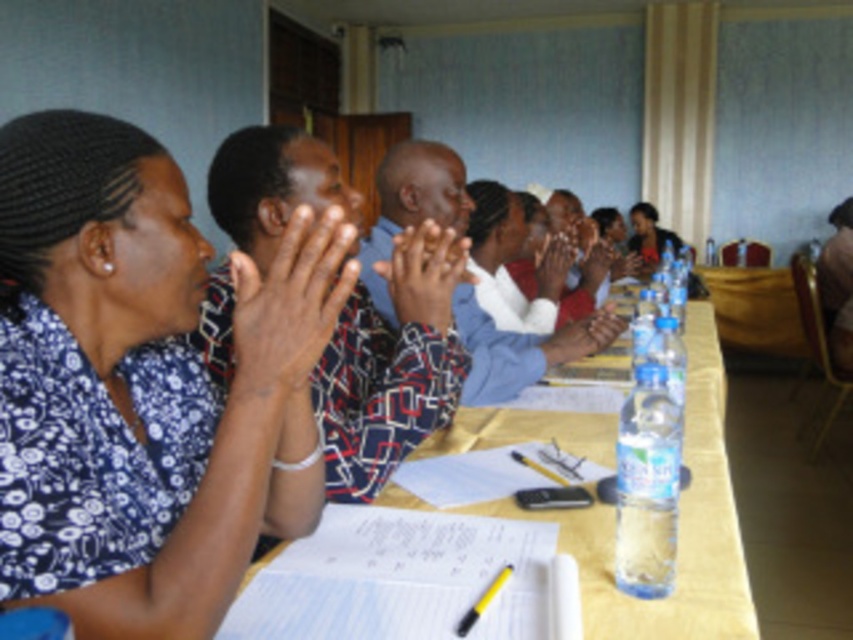
Question: Does yellow matte table at center have a smaller size compared to matte black hands at center?

Choices:
 (A) yes
 (B) no

Answer: (B)

Question: Among these objects, which one is nearest to the camera?

Choices:
 (A) matte plastic hands at center
 (B) blue floral shirt at center
 (C) blue printed shirt at center
 (D) yellow matte table at center

Answer: (B)

Question: Which of the following is the closest to the observer?

Choices:
 (A) matte skin hand at center
 (B) matte plastic hands at center

Answer: (B)

Question: Is blue floral shirt at center below blue printed shirt at center?

Choices:
 (A) yes
 (B) no

Answer: (A)

Question: Which object is positioned closest to the blue floral shirt at center?

Choices:
 (A) matte skin hand at center
 (B) matte plastic hands at center
 (C) yellow matte table at center

Answer: (B)

Question: Considering the relative positions of blue printed shirt at center and dark brown skin at center in the image provided, where is blue printed shirt at center located with respect to dark brown skin at center?

Choices:
 (A) left
 (B) right

Answer: (B)